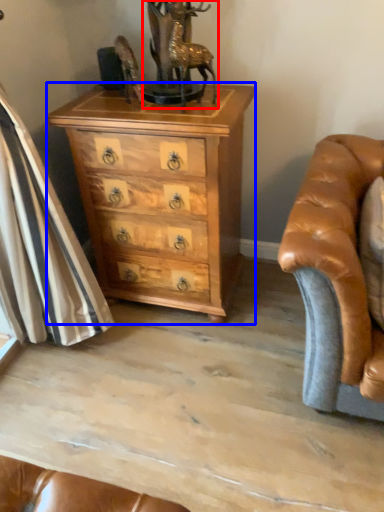
Question: Which object is closer to the camera taking this photo, antique (highlighted by a red box) or chest of drawers (highlighted by a blue box)?

Choices:
 (A) antique
 (B) chest of drawers

Answer: (A)